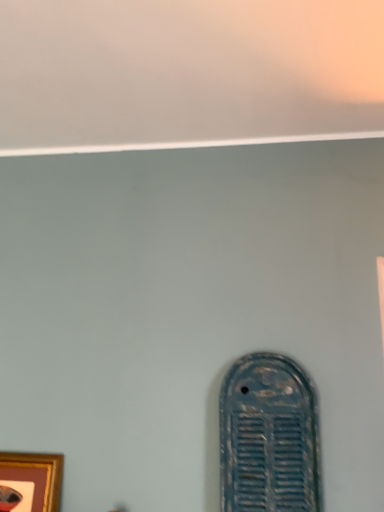
What do you see at coordinates (269, 437) in the screenshot? I see `blue textured vent at center` at bounding box center [269, 437].

Locate an element on the screen. Image resolution: width=384 pixels, height=512 pixels. blue textured vent at center is located at coordinates (x=269, y=437).

The width and height of the screenshot is (384, 512). Identify the location of blue textured vent at center. (269, 437).